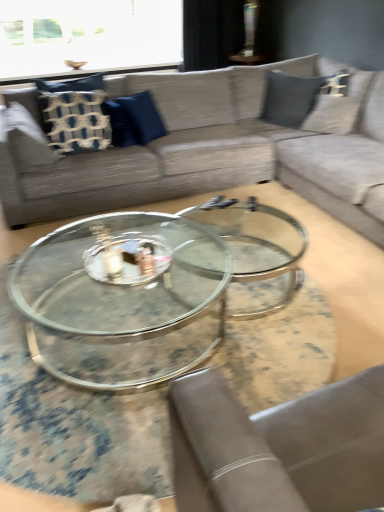
Question: Is textured gray couch at upper center inside blue fabric pillow at center, placed as the 2th pillow when sorted from left to right?

Choices:
 (A) no
 (B) yes

Answer: (A)

Question: Is blue fabric pillow at center, which ranks as the first pillow in right-to-left order, taller than textured gray couch at upper center?

Choices:
 (A) yes
 (B) no

Answer: (B)

Question: Considering the relative sizes of blue fabric pillow at center, which ranks as the first pillow in right-to-left order, and textured gray couch at upper center in the image provided, is blue fabric pillow at center, which ranks as the first pillow in right-to-left order, thinner than textured gray couch at upper center?

Choices:
 (A) yes
 (B) no

Answer: (A)

Question: Considering the relative positions of blue fabric pillow at center, which ranks as the first pillow in right-to-left order, and textured gray couch at upper center in the image provided, is blue fabric pillow at center, which ranks as the first pillow in right-to-left order, to the left of textured gray couch at upper center from the viewer's perspective?

Choices:
 (A) no
 (B) yes

Answer: (B)

Question: Does blue fabric pillow at center, which ranks as the first pillow in right-to-left order, appear on the right side of textured gray couch at upper center?

Choices:
 (A) yes
 (B) no

Answer: (B)

Question: Is blue fabric pillow at center, which ranks as the first pillow in right-to-left order, looking in the opposite direction of textured gray couch at upper center?

Choices:
 (A) yes
 (B) no

Answer: (A)

Question: Considering the relative sizes of blue woven pillow at left, the first pillow viewed from the left, and black fabric curtain at upper center in the image provided, is blue woven pillow at left, the first pillow viewed from the left, smaller than black fabric curtain at upper center?

Choices:
 (A) yes
 (B) no

Answer: (A)

Question: Is blue woven pillow at left, the first pillow viewed from the left, aimed at black fabric curtain at upper center?

Choices:
 (A) no
 (B) yes

Answer: (A)

Question: Can you confirm if blue woven pillow at left, the first pillow viewed from the left, is bigger than black fabric curtain at upper center?

Choices:
 (A) no
 (B) yes

Answer: (A)

Question: Is blue woven pillow at left, the first pillow viewed from the left, further to camera compared to black fabric curtain at upper center?

Choices:
 (A) no
 (B) yes

Answer: (A)

Question: From the image's perspective, would you say blue woven pillow at left, which ranks as the 2th pillow in right-to-left order, is positioned over black fabric curtain at upper center?

Choices:
 (A) no
 (B) yes

Answer: (A)

Question: From the image's perspective, is blue woven pillow at left, the first pillow viewed from the left, under black fabric curtain at upper center?

Choices:
 (A) yes
 (B) no

Answer: (A)

Question: Can you confirm if black fabric curtain at upper center is wider than blue fabric pillow at center, placed as the 2th pillow when sorted from left to right?

Choices:
 (A) no
 (B) yes

Answer: (B)